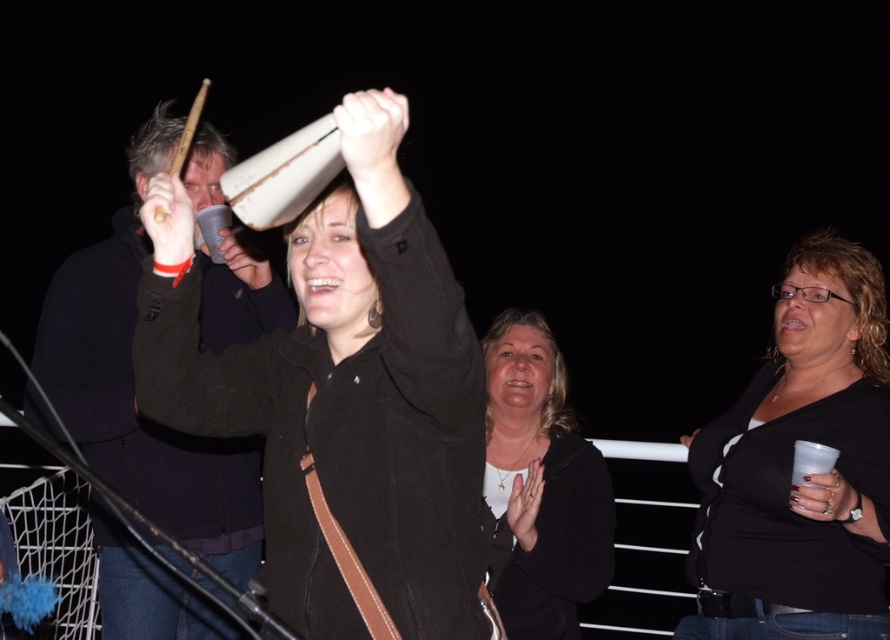
Does black matte shirt at center have a greater width compared to matte black jacket at center?

Indeed, black matte shirt at center has a greater width compared to matte black jacket at center.

Between point (804, 616) and point (551, 472), which one is positioned behind?

The point (551, 472) is behind.

Where is `black matte shirt at center`? black matte shirt at center is located at coordinates (791, 461).